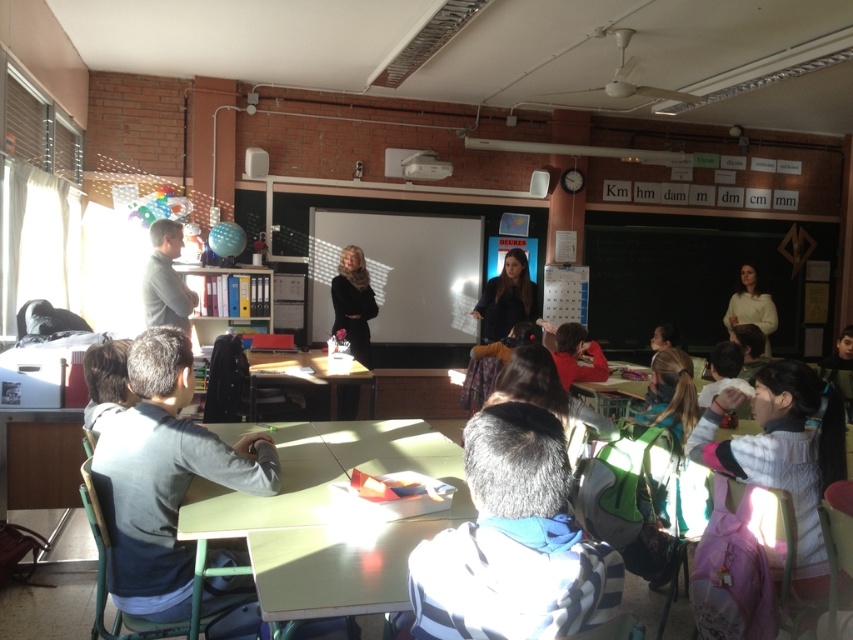
Question: Is gray matte shirt at lower left thinner than matte gray shirt at left?

Choices:
 (A) no
 (B) yes

Answer: (A)

Question: Which point is farther to the camera?

Choices:
 (A) (250, 403)
 (B) (755, 449)
 (C) (318, 508)

Answer: (A)

Question: Where is gray matte shirt at lower left located in relation to white matte shirt at upper right in the image?

Choices:
 (A) above
 (B) below

Answer: (B)

Question: Which point appears closest to the camera in this image?

Choices:
 (A) (750, 220)
 (B) (743, 298)

Answer: (B)

Question: Which point appears farthest from the camera in this image?

Choices:
 (A) (167, 317)
 (B) (694, 310)
 (C) (173, 593)

Answer: (B)

Question: Where is green matte table at center located in relation to matte gray shirt at left in the image?

Choices:
 (A) below
 (B) above

Answer: (A)